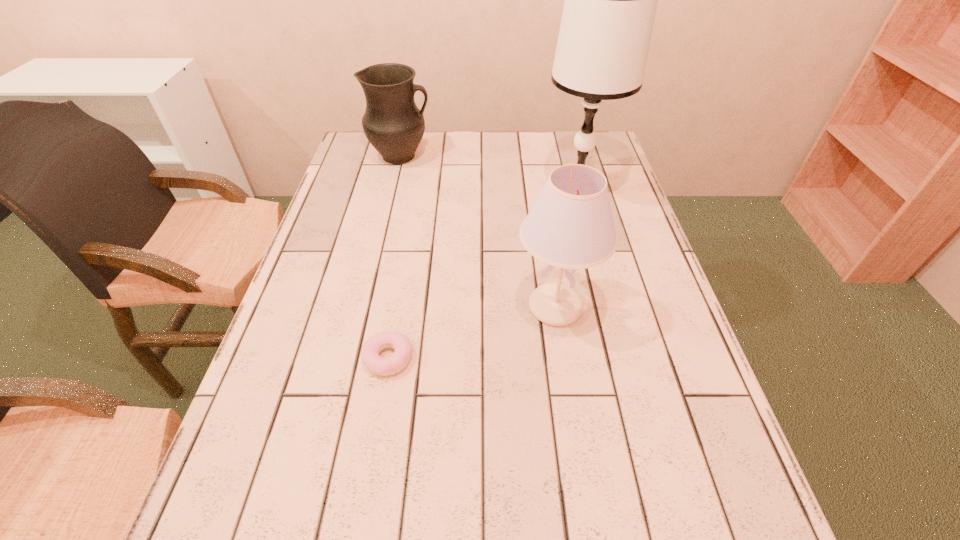
Where is `object that is at the right edge`? Image resolution: width=960 pixels, height=540 pixels. object that is at the right edge is located at coordinates (610, 4).

Where is `object that is at the far left corner`? The height and width of the screenshot is (540, 960). object that is at the far left corner is located at coordinates (393, 124).

Locate an element on the screen. This screenshot has width=960, height=540. vacant point at the far edge is located at coordinates (439, 167).

Locate an element on the screen. Image resolution: width=960 pixels, height=540 pixels. vacant space at the left edge of the desktop is located at coordinates (311, 264).

Locate an element on the screen. free space at the right edge is located at coordinates (635, 230).

Where is `free location at the far left corner of the desktop`? free location at the far left corner of the desktop is located at coordinates (359, 160).

You are a GUI agent. You are given a task and a screenshot of the screen. Output one action in this format:
    pyautogui.click(x=<x>, y=<y>)
    Task: Click on the vacant space that's between the third tallest object and the tallest object
    The height and width of the screenshot is (540, 960).
    Given the screenshot: What is the action you would take?
    [489, 174]

You are a GUI agent. You are given a task and a screenshot of the screen. Output one action in this format:
    pyautogui.click(x=<x>, y=<y>)
    Task: Click on the vacant area between the doughnut and the third tallest object
    The image size is (960, 540).
    Given the screenshot: What is the action you would take?
    pyautogui.click(x=395, y=257)

At what (x,y) coordinates should I click in order to perform the action: click on free area in between the pitcher and the doughnut. Please return your answer as a coordinate pair (x, y). This screenshot has height=540, width=960. Looking at the image, I should click on (395, 257).

Locate an element on the screen. Image resolution: width=960 pixels, height=540 pixels. unoccupied position between the doughnut and the pitcher is located at coordinates (395, 257).